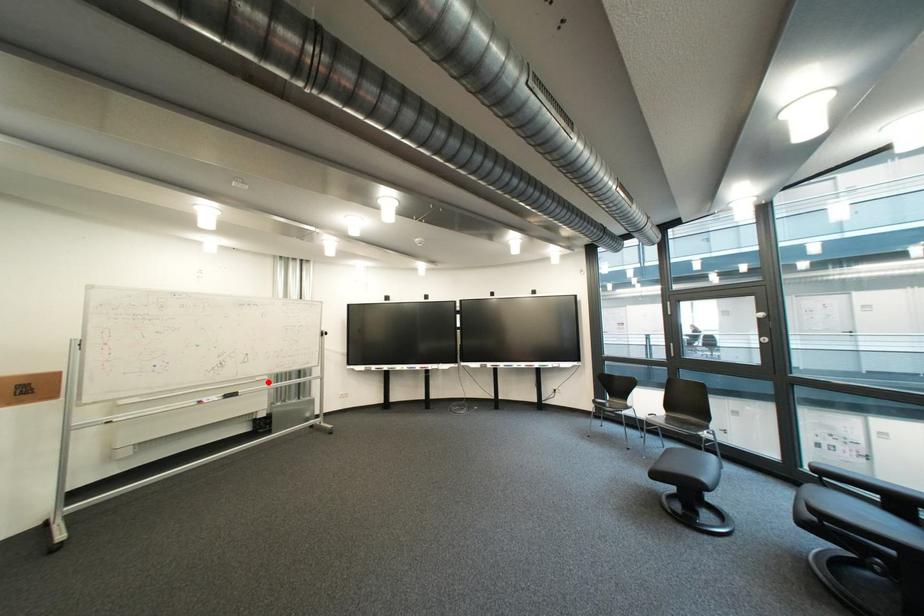
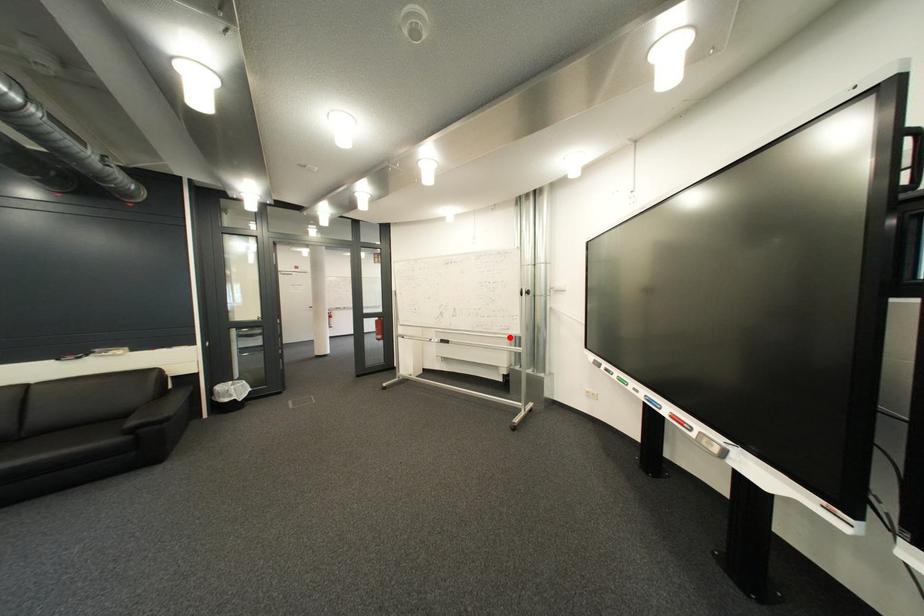
From the picture: I am providing you with two images of the same scene from different viewpoints. A red point is marked on the first image and another point is marked on the second image. Is the marked point in image1 the same physical position as the marked point in image2?

Yes